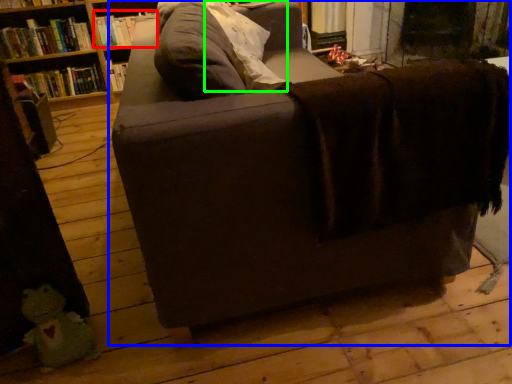
Question: Which is farther away from book (highlighted by a red box)? studio couch (highlighted by a blue box) or pillow (highlighted by a green box)?

Choices:
 (A) studio couch
 (B) pillow

Answer: (A)